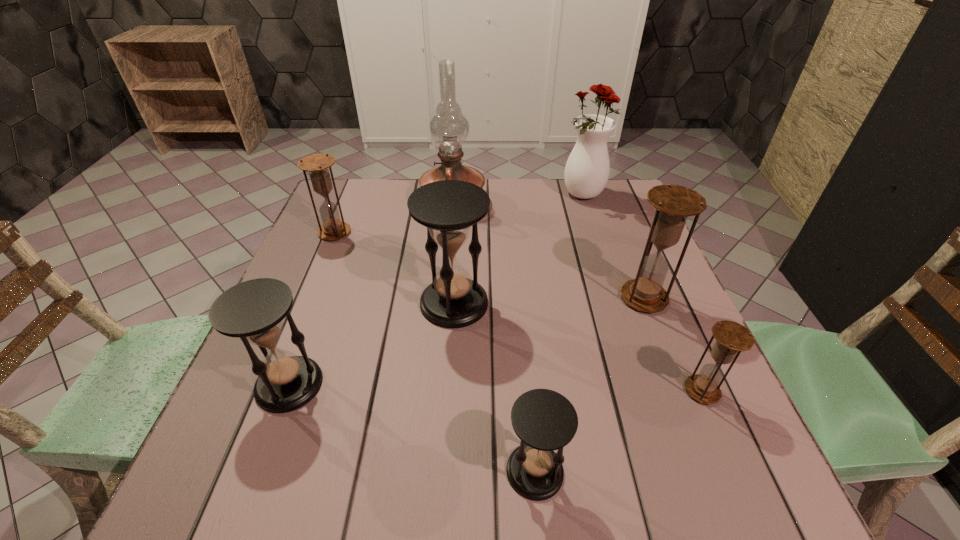
Where is `the sixth closest object to the smallest black hourglass`? the sixth closest object to the smallest black hourglass is located at coordinates click(317, 165).

Identify which object is the fourth closest to the vase. Please provide its 2D coordinates. Your answer should be formatted as a tuple, i.e. [(x, y)], where the tuple contains the x and y coordinates of a point satisfying the conditions above.

[(732, 337)]

Identify which hourglass is the third closest to the second biggest black hourglass. Please provide its 2D coordinates. Your answer should be formatted as a tuple, i.e. [(x, y)], where the tuple contains the x and y coordinates of a point satisfying the conditions above.

[(317, 165)]

Locate which hourglass ranks in proximity to the second smallest brown hourglass. Please provide its 2D coordinates. Your answer should be formatted as a tuple, i.e. [(x, y)], where the tuple contains the x and y coordinates of a point satisfying the conditions above.

[(449, 209)]

Locate which black hourglass is the closest to the second biggest black hourglass. Please provide its 2D coordinates. Your answer should be formatted as a tuple, i.e. [(x, y)], where the tuple contains the x and y coordinates of a point satisfying the conditions above.

[(449, 209)]

This screenshot has height=540, width=960. In order to click on black hourglass object that ranks as the closest to the farthest hourglass in this screenshot , I will do `click(449, 209)`.

I want to click on brown hourglass that is the closest to the oil lamp, so click(x=317, y=165).

Where is `brown hourglass object that ranks as the second closest to the nearest brown hourglass`? brown hourglass object that ranks as the second closest to the nearest brown hourglass is located at coordinates (317, 165).

The height and width of the screenshot is (540, 960). Identify the location of vacant space that satisfies the following two spatial constraints: 1. on the front side of the second nearest brown hourglass; 2. on the right side of the oil lamp. (444, 298).

At what (x,y) coordinates should I click in order to perform the action: click on vacant space that satisfies the following two spatial constraints: 1. on the back side of the seventh shortest object; 2. on the left side of the nearest hourglass. Please return your answer as a coordinate pair (x, y). The width and height of the screenshot is (960, 540). Looking at the image, I should click on 510,195.